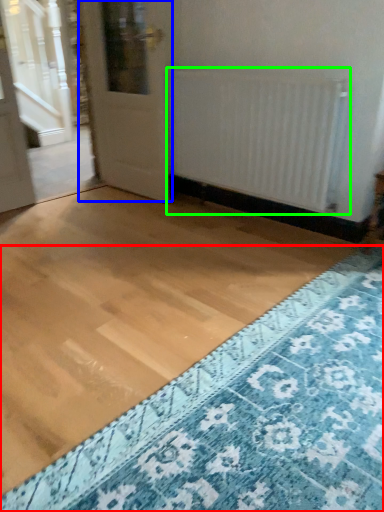
Question: Based on their relative distances, which object is nearer to doormat (highlighted by a red box)? Choose from door (highlighted by a blue box) and radiator (highlighted by a green box).

Choices:
 (A) door
 (B) radiator

Answer: (B)